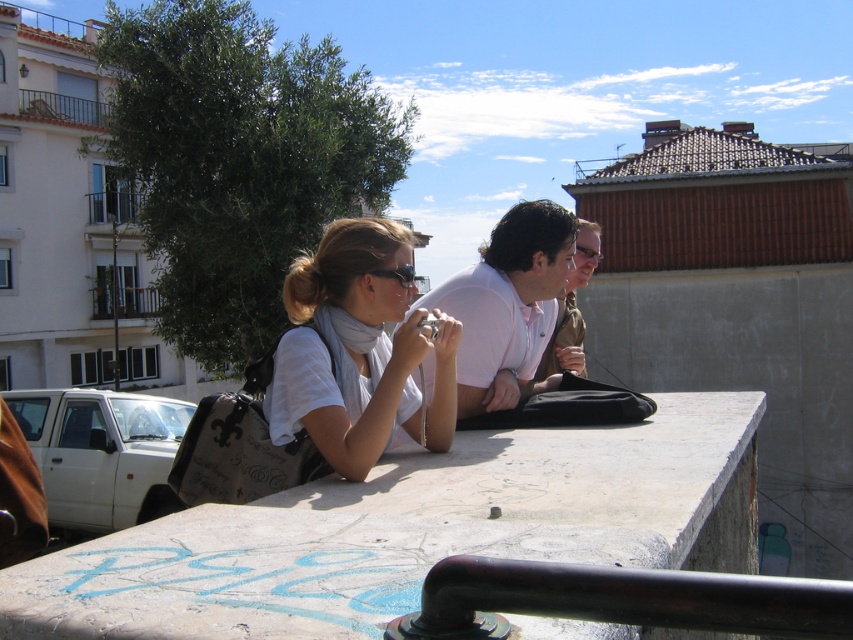
Is dark brown metal rail at lower center shorter than white matte shirt at center?

Correct, dark brown metal rail at lower center is not as tall as white matte shirt at center.

Which is in front, point (669, 616) or point (544, 269)?

Point (669, 616) is more forward.

Is point (566, 577) farther from camera compared to point (471, 305)?

No, it is not.

Locate an element on the screen. The height and width of the screenshot is (640, 853). dark brown metal rail at lower center is located at coordinates (619, 600).

Is white matte scarf at center behind dark brown metal rail at lower center?

That is True.

Can you confirm if white matte scarf at center is taller than dark brown metal rail at lower center?

Correct, white matte scarf at center is much taller as dark brown metal rail at lower center.

Which is behind, point (332, 410) or point (480, 596)?

Point (332, 410)

At what (x,y) coordinates should I click in order to perform the action: click on white matte scarf at center. Please return your answer as a coordinate pair (x, y). Looking at the image, I should click on (358, 349).

Consider the image. Who is positioned more to the left, white matte scarf at center or matte white shirt at center?

From the viewer's perspective, white matte scarf at center appears more on the left side.

Can you confirm if white matte scarf at center is smaller than matte white shirt at center?

Yes.

Who is more distant from viewer, (341, 292) or (560, 310)?

Positioned behind is point (560, 310).

Locate an element on the screen. This screenshot has height=640, width=853. white matte scarf at center is located at coordinates (358, 349).